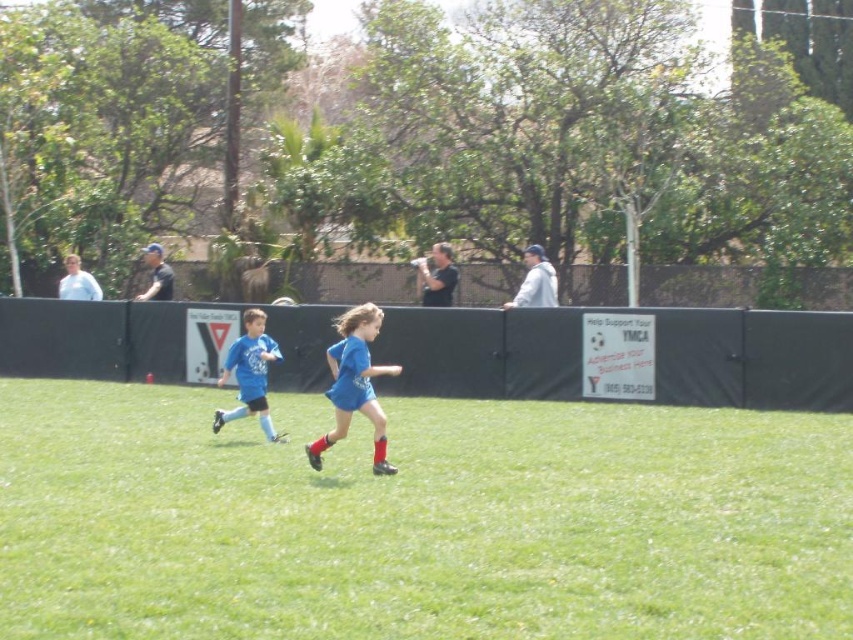
Find the location of `blue matte soccer jersey at center`. blue matte soccer jersey at center is located at coordinates (354, 384).

Who is positioned more to the left, blue matte soccer jersey at center or blue jersey at center?

blue jersey at center is more to the left.

Describe the element at coordinates (354, 384) in the screenshot. I see `blue matte soccer jersey at center` at that location.

Locate an element on the screen. The width and height of the screenshot is (853, 640). blue matte soccer jersey at center is located at coordinates (354, 384).

Between green grass at center and blue jersey at center, which one has more height?

blue jersey at center is taller.

Who is higher up, green grass at center or blue jersey at center?

blue jersey at center is above.

Does point (726, 628) come in front of point (253, 384)?

Yes, it is in front of point (253, 384).

The height and width of the screenshot is (640, 853). I want to click on green grass at center, so click(x=418, y=518).

Does green grass at center appear over blue matte soccer jersey at center?

No, green grass at center is not above blue matte soccer jersey at center.

Is the position of green grass at center less distant than that of blue matte soccer jersey at center?

Yes.

You are a GUI agent. You are given a task and a screenshot of the screen. Output one action in this format:
    pyautogui.click(x=<x>, y=<y>)
    Task: Click on the green grass at center
    This screenshot has height=640, width=853.
    Given the screenshot: What is the action you would take?
    pyautogui.click(x=418, y=518)

Identify the location of green grass at center. The height and width of the screenshot is (640, 853). (418, 518).